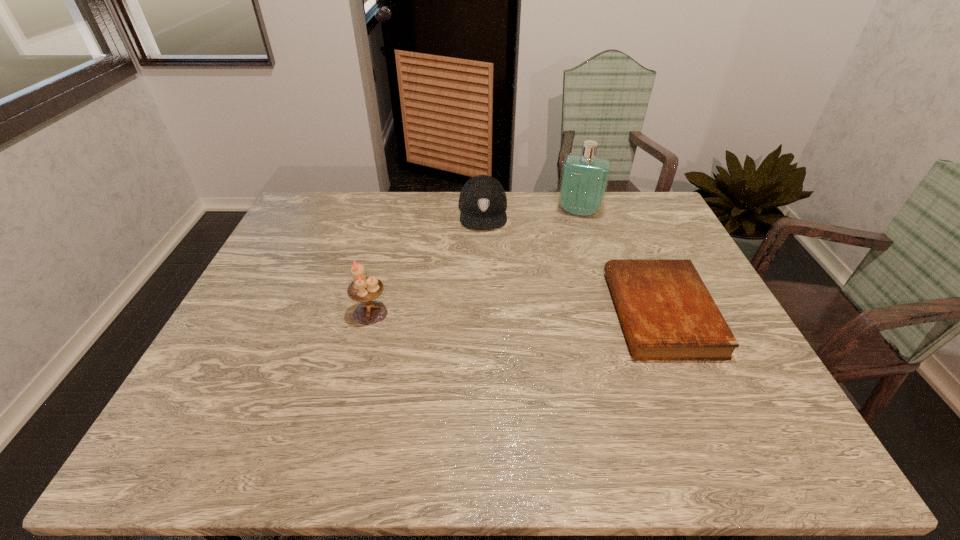
Where is `the second tallest object`? The width and height of the screenshot is (960, 540). the second tallest object is located at coordinates (364, 289).

You are a GUI agent. You are given a task and a screenshot of the screen. Output one action in this format:
    pyautogui.click(x=<x>, y=<y>)
    Task: Click on the leftmost object
    The width and height of the screenshot is (960, 540).
    Given the screenshot: What is the action you would take?
    pyautogui.click(x=364, y=289)

I want to click on the shortest object, so click(667, 313).

The image size is (960, 540). Identify the location of the tallest object. (584, 178).

Where is `cap`? The height and width of the screenshot is (540, 960). cap is located at coordinates (482, 201).

Where is `the second object from left to right`? The width and height of the screenshot is (960, 540). the second object from left to right is located at coordinates (482, 201).

You are a GUI agent. You are given a task and a screenshot of the screen. Output one action in this format:
    pyautogui.click(x=<x>, y=<y>)
    Task: Click on the free point located on the back of the candle holder
    This screenshot has height=540, width=960.
    Given the screenshot: What is the action you would take?
    pyautogui.click(x=380, y=277)

Locate an element on the screen. The height and width of the screenshot is (540, 960). free space located 0.120m on the spine side of the Bible is located at coordinates (570, 313).

Find the location of a particular element. This screenshot has width=960, height=540. free space located 0.320m on the spine side of the Bible is located at coordinates point(494,313).

Where is `free space located on the spine side of the Bible`? The width and height of the screenshot is (960, 540). free space located on the spine side of the Bible is located at coordinates (574, 313).